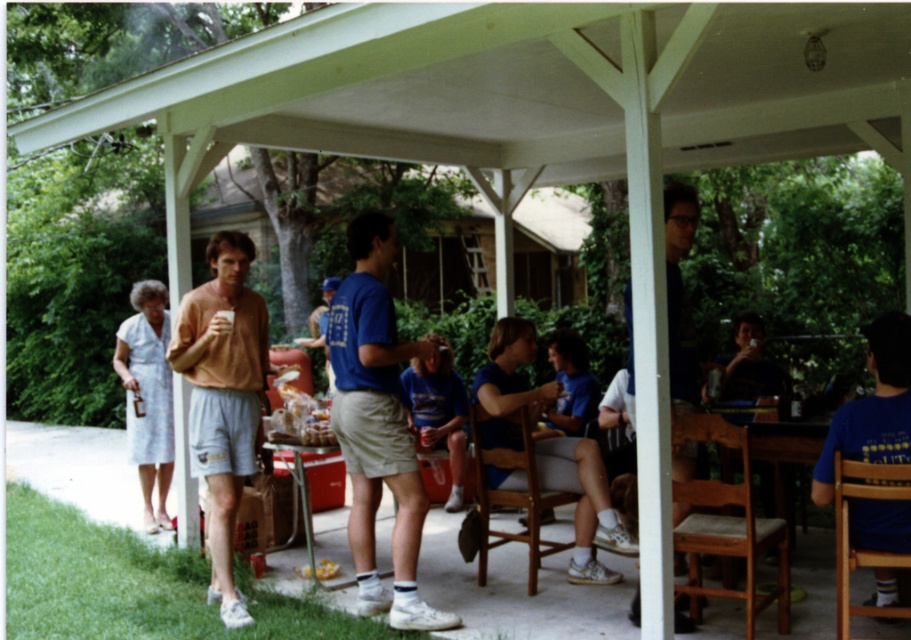
Between blue t-shirt at center and matte orange shirt at left, which one has less height?

matte orange shirt at left

Is blue t-shirt at center taller than matte orange shirt at left?

Yes.

Image resolution: width=911 pixels, height=640 pixels. Identify the location of blue t-shirt at center. [x=377, y=426].

Who is more forward, (233, 381) or (684, 250)?

Point (684, 250) is more forward.

In the scene shown: Between matte orange shirt at left and matte blue shirt at center, which one has more height?

matte orange shirt at left

Find the location of a particular element. matte orange shirt at left is located at coordinates (223, 397).

Find the location of `matte orange shirt at left`. matte orange shirt at left is located at coordinates (223, 397).

From the picture: Is blue t-shirt at center further to camera compared to matte blue shirt at center?

That is True.

Which is above, blue t-shirt at center or matte blue shirt at center?

matte blue shirt at center is higher up.

Is point (347, 518) more distant than point (687, 202)?

Yes, point (347, 518) is farther from viewer.

You are a GUI agent. You are given a task and a screenshot of the screen. Output one action in this format:
    pyautogui.click(x=<x>, y=<y>)
    Task: Click on the blue t-shirt at center
    
    Given the screenshot: What is the action you would take?
    pyautogui.click(x=377, y=426)